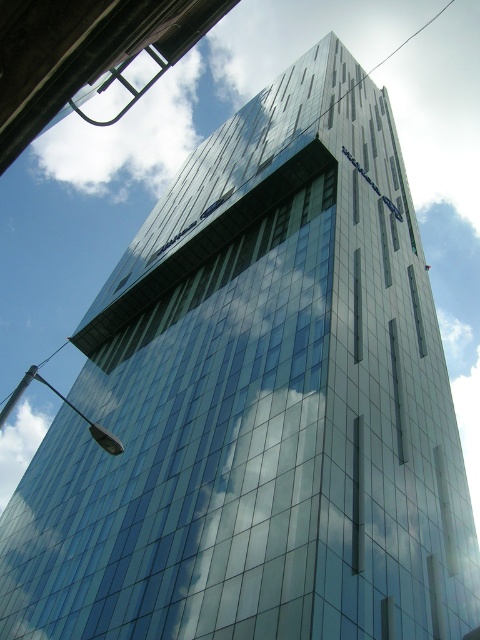
You are a drone operator planning to fly a drone between the white cloud at upper left and the transparent glass window at center. The drone has a maximum flight range of 1000 feet. Can the drone safely complete this flight without running out of battery?

The white cloud at upper left and transparent glass window at center are 922.77 feet apart from each other. Since the drone has a maximum flight range of 1000 feet, it can safely complete the flight between them without running out of battery as the distance is within its range.

You are a drone operator preparing to fly a drone with a 1.5 meters wingspan. You want to capture a closeup shot of the white fluffy cloud at upper left. Considering the drone must stay at least 10 meters away from any clouds to avoid turbulence, is the current distance safe?

The white fluffy cloud at upper left is 15.81 meters from camera. Since the drone must stay at least 10 meters away from the cloud, the current distance of 15.81 meters is safe as it exceeds the minimum required distance of 10 meters.

You are a drone operator trying to capture the reflection of the white fluffy cloud at upper left on the building. The drone has a camera with a 100mm lens. According to the coordinates provided, where should you position the drone to ensure the reflection is centered in the camera frame?

The white fluffy cloud at upper left is located at coordinates point (127, 136). To center its reflection in the camera frame, position the drone directly above this coordinate point.